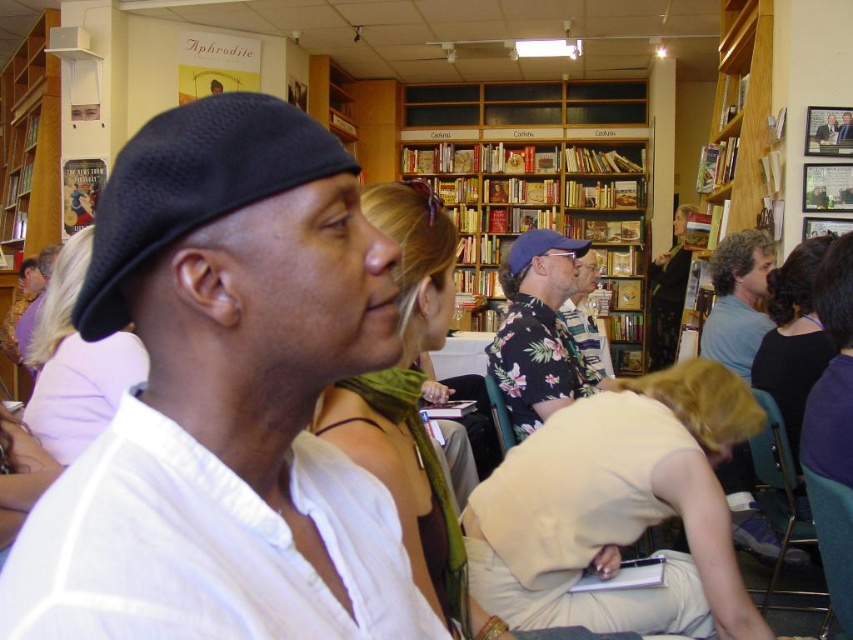
Find the location of a particular element. This screenshot has width=853, height=640. green scarf at center is located at coordinates (416, 416).

Between point (368, 442) and point (585, 168), which one is positioned behind?

The point (585, 168) is behind.

Find the location of `green scarf at center`. green scarf at center is located at coordinates point(416,416).

Who is taller, wooden bookshelf at upper left or blue fabric baseball cap at center?

Standing taller between the two is wooden bookshelf at upper left.

Does wooden bookshelf at upper left have a smaller size compared to blue fabric baseball cap at center?

Incorrect, wooden bookshelf at upper left is not smaller in size than blue fabric baseball cap at center.

Which is behind, point (45, 132) or point (566, 240)?

The point (45, 132) is behind.

Image resolution: width=853 pixels, height=640 pixels. Identify the location of wooden bookshelf at upper left. (30, 141).

In the scene shown: Can you confirm if beige fabric dress at lower center is smaller than blue fabric baseball cap at center?

Incorrect, beige fabric dress at lower center is not smaller in size than blue fabric baseball cap at center.

Is beige fabric dress at lower center closer to camera compared to blue fabric baseball cap at center?

That is True.

Locate an element on the screen. The image size is (853, 640). beige fabric dress at lower center is located at coordinates (619, 508).